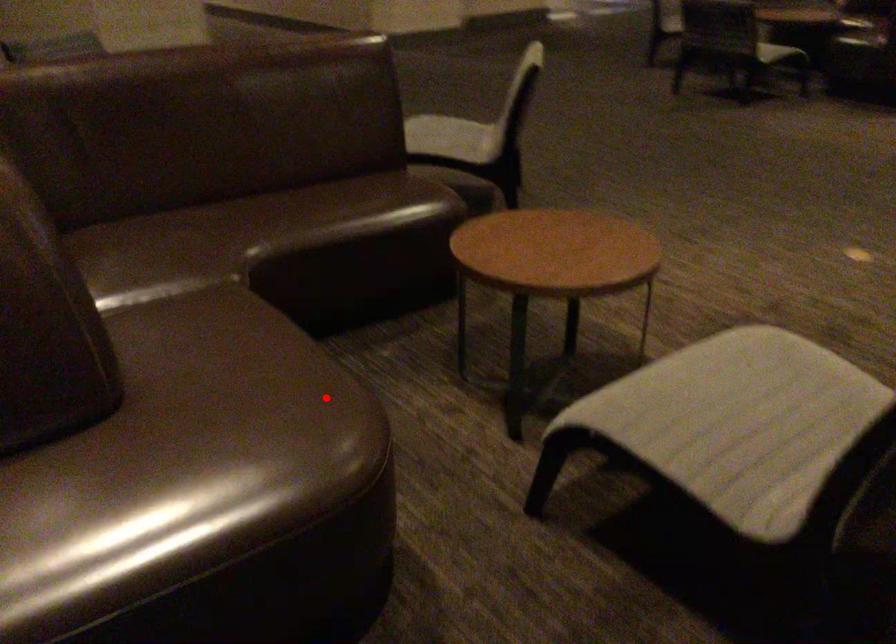
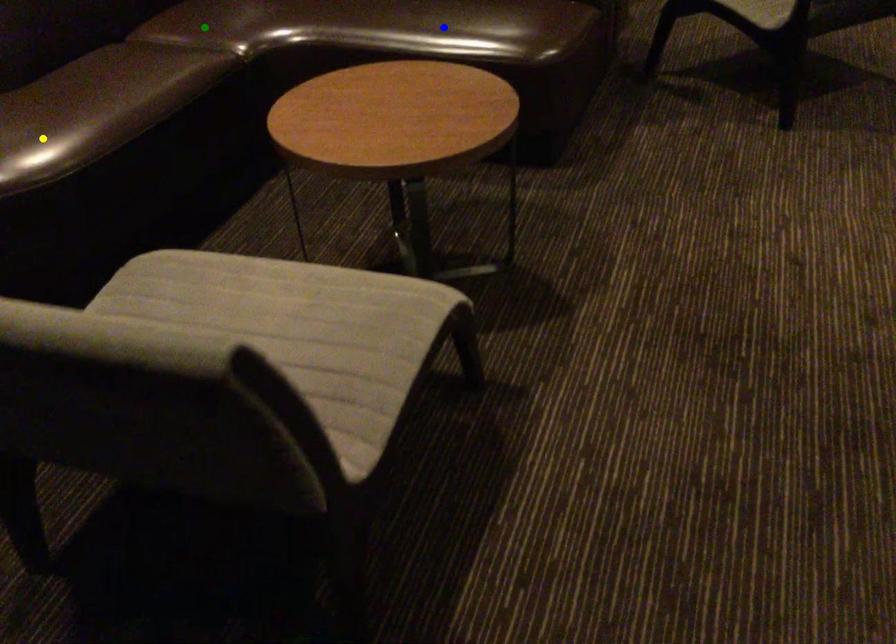
Question: I am providing you with two images of the same scene from different viewpoints. A red point is marked on the first image. You are given multiple points on the second image. Which spot in image 2 lines up with the point in image 1?

Choices:
 (A) yellow point
 (B) green point
 (C) blue point

Answer: (A)